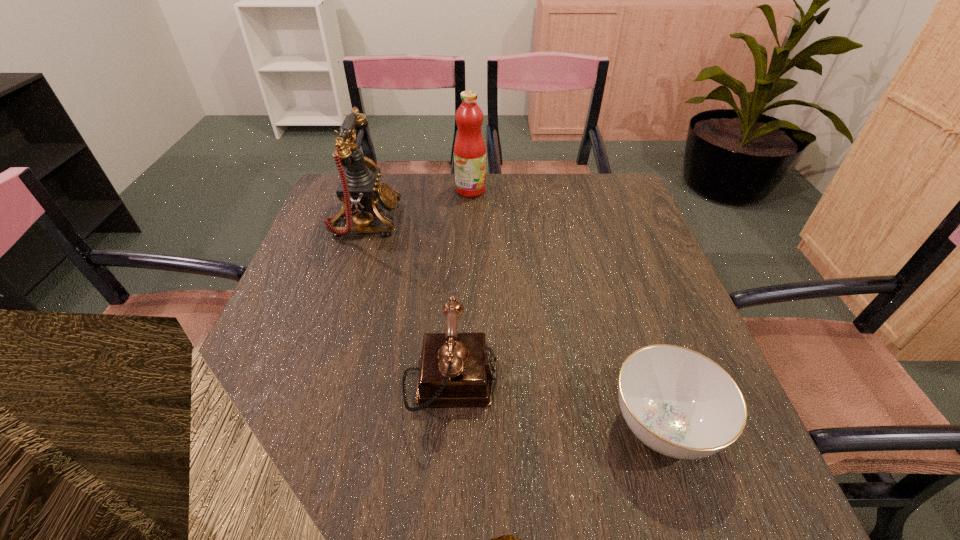
Locate an element on the screen. Image resolution: width=960 pixels, height=540 pixels. vacant area that lies between the fruit juice and the taller telephone is located at coordinates (418, 205).

Identify the location of vacant area between the fruit juice and the farther telephone. Image resolution: width=960 pixels, height=540 pixels. (418, 205).

This screenshot has height=540, width=960. Identify the location of free space between the fruit juice and the taller telephone. (418, 205).

Where is `the second closest object to the left telephone`? The width and height of the screenshot is (960, 540). the second closest object to the left telephone is located at coordinates (456, 369).

Locate an element on the screen. This screenshot has height=540, width=960. object that stands as the second closest to the chinaware is located at coordinates (360, 192).

The width and height of the screenshot is (960, 540). What are the coordinates of `free spot that satisfies the following two spatial constraints: 1. on the back side of the shortest object; 2. on the front label of the fruit juice` in the screenshot? It's located at (586, 190).

The image size is (960, 540). I want to click on vacant point that satisfies the following two spatial constraints: 1. on the back side of the chinaware; 2. on the dial of the second shortest object, so click(x=648, y=382).

This screenshot has height=540, width=960. In order to click on vacant region that satisfies the following two spatial constraints: 1. on the back side of the shortest object; 2. on the dial of the right telephone in this screenshot , I will do `click(648, 382)`.

You are a GUI agent. You are given a task and a screenshot of the screen. Output one action in this format:
    pyautogui.click(x=<x>, y=<y>)
    Task: Click on the free spot that satisfies the following two spatial constraints: 1. on the back side of the chinaware; 2. on the front of the leftmost object, featuring the rotary dial
    This screenshot has height=540, width=960.
    Given the screenshot: What is the action you would take?
    [x=595, y=220]

What are the coordinates of `vacant region that satisfies the following two spatial constraints: 1. on the front label of the fruit juice; 2. on the right side of the chinaware` in the screenshot? It's located at (464, 427).